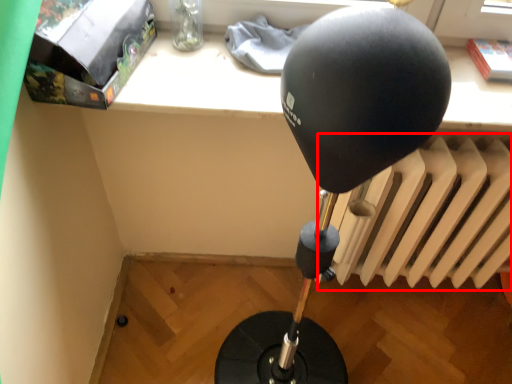
Question: From the image's perspective, what is the correct spatial positioning of radiator (annotated by the red box) in reference to package?

Choices:
 (A) below
 (B) above

Answer: (A)